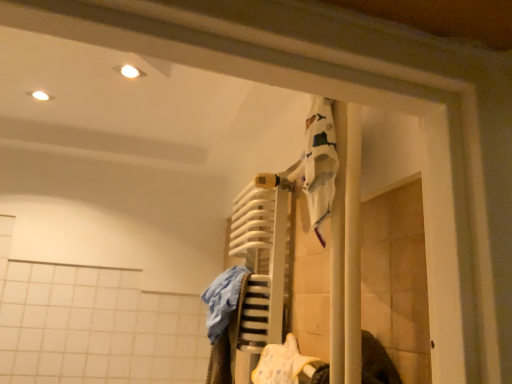
Question: In which direction should I rotate to look at yellow fabric at lower center, which is the second clothing from left to right?

Choices:
 (A) left
 (B) right

Answer: (B)

Question: Is blue cotton towel at center, acting as the second clothing starting from the right, to the right of yellow fabric at lower center, the first clothing when ordered from right to left, from the viewer's perspective?

Choices:
 (A) yes
 (B) no

Answer: (B)

Question: From the image's perspective, is blue cotton towel at center, acting as the second clothing starting from the right, on top of yellow fabric at lower center, the first clothing when ordered from right to left?

Choices:
 (A) no
 (B) yes

Answer: (B)

Question: Is blue cotton towel at center, which appears as the 1th clothing when viewed from the left, to the left of yellow fabric at lower center, which is the second clothing from left to right, from the viewer's perspective?

Choices:
 (A) yes
 (B) no

Answer: (A)

Question: Is blue cotton towel at center, which appears as the 1th clothing when viewed from the left, located outside yellow fabric at lower center, the first clothing when ordered from right to left?

Choices:
 (A) yes
 (B) no

Answer: (A)

Question: Is the depth of blue cotton towel at center, acting as the second clothing starting from the right, less than that of yellow fabric at lower center, which is the second clothing from left to right?

Choices:
 (A) no
 (B) yes

Answer: (A)

Question: From the image's perspective, would you say blue cotton towel at center, which appears as the 1th clothing when viewed from the left, is shown under yellow fabric at lower center, which is the second clothing from left to right?

Choices:
 (A) yes
 (B) no

Answer: (B)

Question: Is yellow fabric at lower center, the first clothing when ordered from right to left, smaller than blue cotton towel at center, acting as the second clothing starting from the right?

Choices:
 (A) yes
 (B) no

Answer: (A)

Question: Is the depth of yellow fabric at lower center, the first clothing when ordered from right to left, greater than that of blue cotton towel at center, acting as the second clothing starting from the right?

Choices:
 (A) no
 (B) yes

Answer: (A)

Question: Does yellow fabric at lower center, which is the second clothing from left to right, have a greater height compared to blue cotton towel at center, acting as the second clothing starting from the right?

Choices:
 (A) yes
 (B) no

Answer: (B)

Question: Is the depth of yellow fabric at lower center, which is the second clothing from left to right, less than that of blue cotton towel at center, which appears as the 1th clothing when viewed from the left?

Choices:
 (A) yes
 (B) no

Answer: (A)

Question: Is yellow fabric at lower center, which is the second clothing from left to right, in contact with blue cotton towel at center, acting as the second clothing starting from the right?

Choices:
 (A) yes
 (B) no

Answer: (B)

Question: Is yellow fabric at lower center, which is the second clothing from left to right, shorter than blue cotton towel at center, which appears as the 1th clothing when viewed from the left?

Choices:
 (A) no
 (B) yes

Answer: (B)

Question: Is yellow fabric at lower center, the first clothing when ordered from right to left, in front of or behind blue cotton towel at center, which appears as the 1th clothing when viewed from the left, in the image?

Choices:
 (A) front
 (B) behind

Answer: (A)